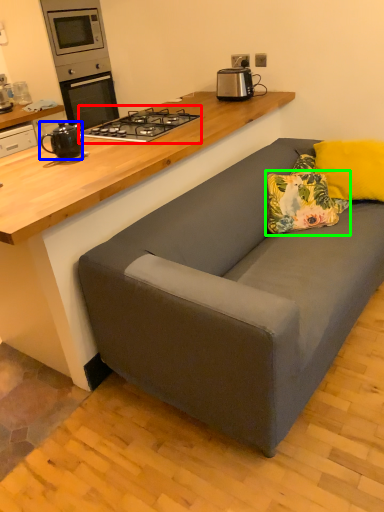
Question: Estimate the real-world distances between objects in this image. Which object is closer to gas stove (highlighted by a red box), kitchen appliance (highlighted by a blue box) or pillow (highlighted by a green box)?

Choices:
 (A) kitchen appliance
 (B) pillow

Answer: (A)